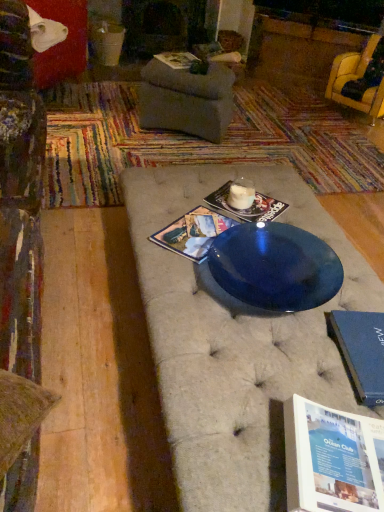
You are a GUI agent. You are given a task and a screenshot of the screen. Output one action in this format:
    pyautogui.click(x=<x>, y=<y>)
    Task: Click on the blank space situated above matte paper magazine at center, arranged as the third magazine when viewed from the back (from a real-world perspective)
    
    Given the screenshot: What is the action you would take?
    pyautogui.click(x=205, y=226)